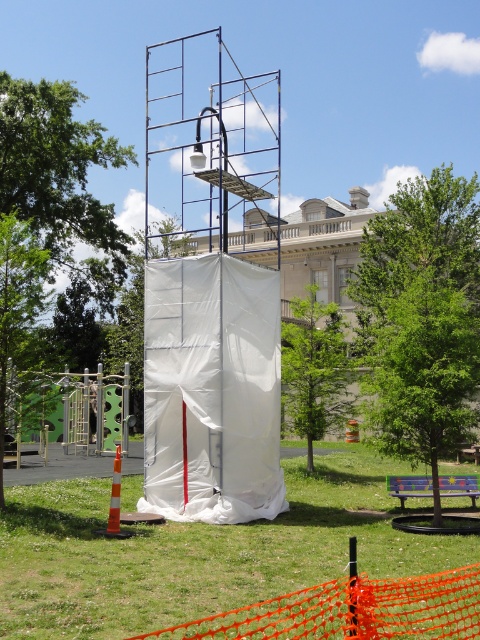
This screenshot has height=640, width=480. What do you see at coordinates (212, 390) in the screenshot?
I see `white fabric tent at center` at bounding box center [212, 390].

You are a GUI agent. You are given a task and a screenshot of the screen. Output one action in this format:
    pyautogui.click(x=<x>, y=<y>)
    Task: Click on the white fabric tent at center
    The height and width of the screenshot is (640, 480).
    Given the screenshot: What is the action you would take?
    pyautogui.click(x=212, y=390)

Is point (342, 490) less distant than point (113, 508)?

No, it is not.

Does point (87, 605) lie behind point (109, 516)?

No, (87, 605) is in front of (109, 516).

Image resolution: width=480 pixels, height=640 pixels. What are the coordinates of `green grass at lower center` in the screenshot? It's located at (200, 552).

Can you confirm if green grass at lower center is positioned to the right of white fabric tent at center?

Indeed, green grass at lower center is positioned on the right side of white fabric tent at center.

Is green grass at lower center taller than white fabric tent at center?

No.

This screenshot has width=480, height=640. What do you see at coordinates (200, 552) in the screenshot? I see `green grass at lower center` at bounding box center [200, 552].

Where is `green grass at lower center`? The width and height of the screenshot is (480, 640). green grass at lower center is located at coordinates (200, 552).